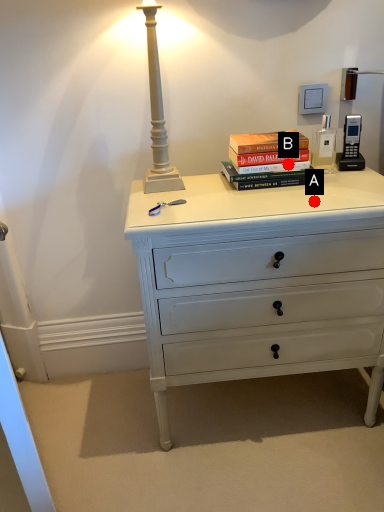
Question: Two points are circled on the image, labeled by A and B beside each circle. Which point is closer to the camera?

Choices:
 (A) A is closer
 (B) B is closer

Answer: (A)